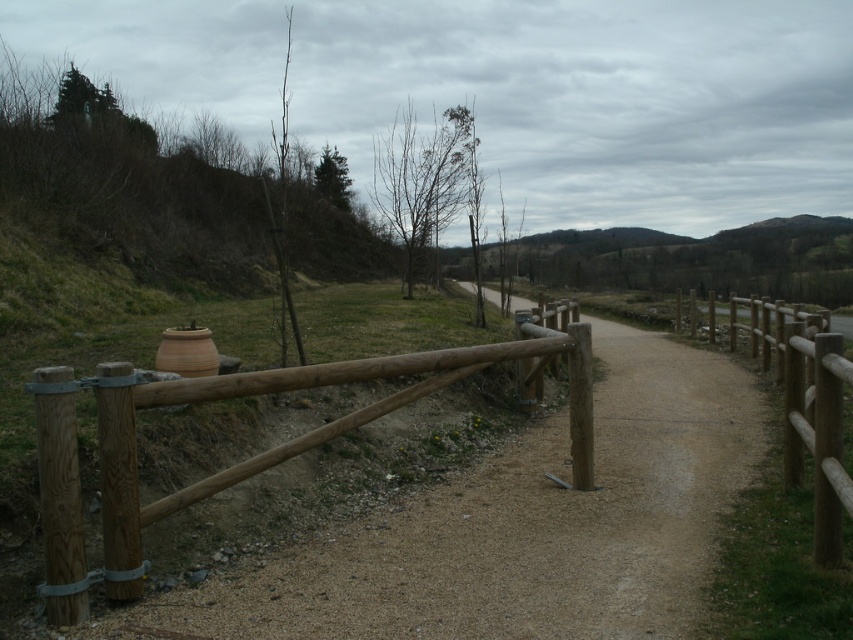
Question: Does brown wooden fence at center-left appear on the left side of brown wooden fence at right?

Choices:
 (A) yes
 (B) no

Answer: (A)

Question: Is brown wooden fence at center-left wider than brown wooden fence at right?

Choices:
 (A) no
 (B) yes

Answer: (A)

Question: Which point is farther from the camera taking this photo?

Choices:
 (A) 833,467
 (B) 490,348

Answer: (B)

Question: Which point is farther to the camera?

Choices:
 (A) (67, 454)
 (B) (828, 436)

Answer: (B)

Question: In this image, where is brown wooden fence at center-left located relative to brown wooden fence at right?

Choices:
 (A) right
 (B) left

Answer: (B)